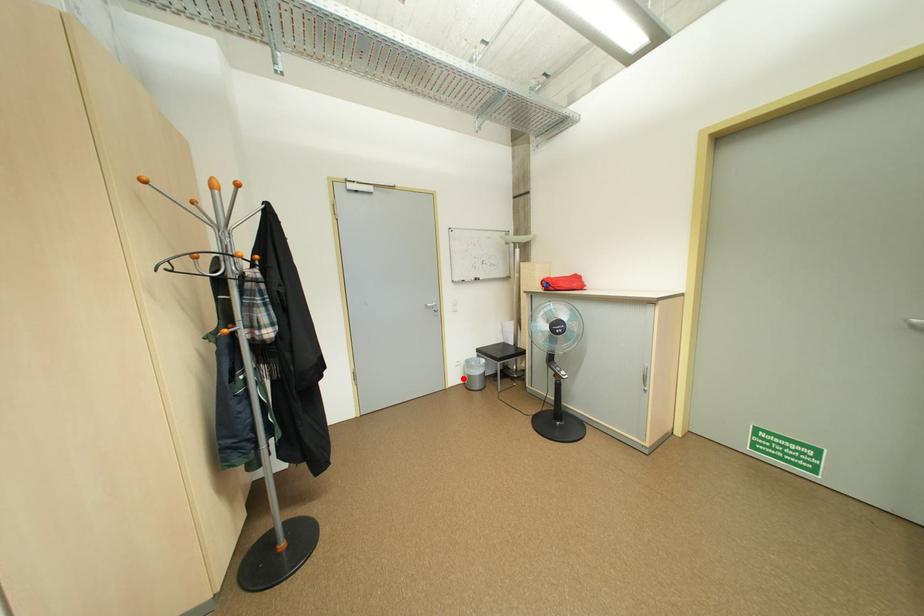
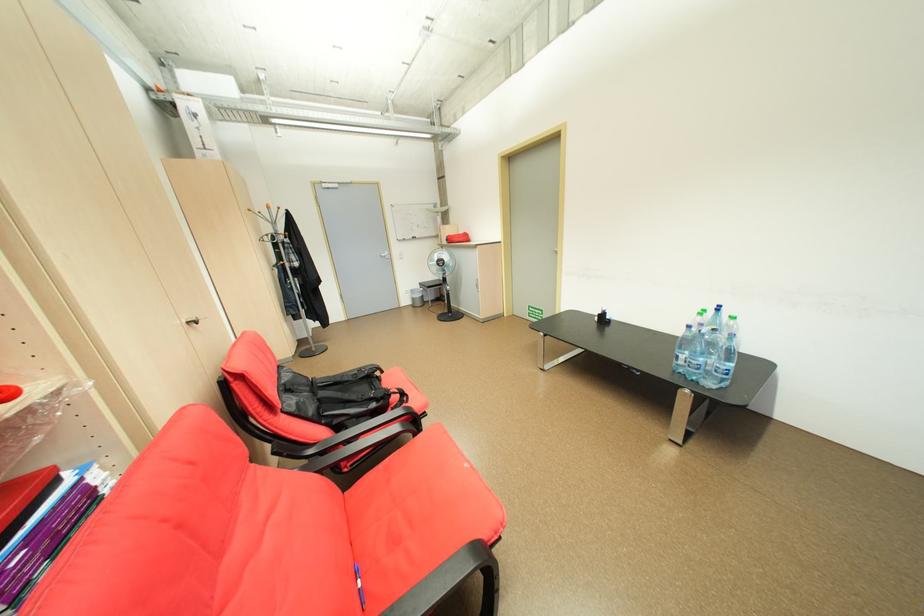
Question: I am providing you with two images of the same scene from different viewpoints. In image1, a red point is highlighted. Considering the same 3D point in image2, which of the following is correct?

Choices:
 (A) It is closer
 (B) It is farther

Answer: (A)